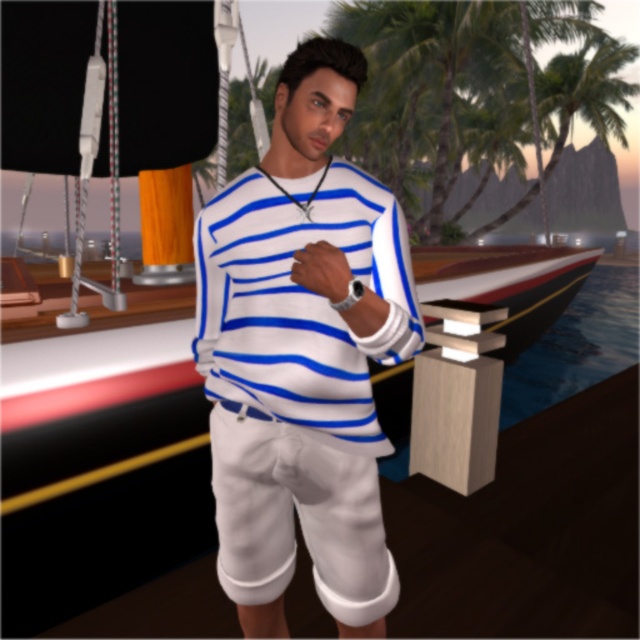
Question: Can you confirm if white matte sweater at center is positioned to the left of green leafy palm tree at upper center?

Choices:
 (A) yes
 (B) no

Answer: (A)

Question: Observing the image, what is the correct spatial positioning of white striped sweater at center in reference to green leafy palm tree at upper center?

Choices:
 (A) above
 (B) below

Answer: (B)

Question: Which object appears closest to the camera in this image?

Choices:
 (A) white cotton shorts at center
 (B) white matte sweater at center
 (C) white striped sweater at center

Answer: (B)

Question: Which object is farther from the camera taking this photo?

Choices:
 (A) green leafy palm tree at upper center
 (B) white striped sweater at center

Answer: (A)

Question: Based on their relative distances, which object is nearer to the green leafy palm tree at upper center?

Choices:
 (A) white cotton shorts at center
 (B) white striped sweater at center

Answer: (B)

Question: Can you confirm if white striped sweater at center is positioned to the left of green leafy palm tree at upper center?

Choices:
 (A) yes
 (B) no

Answer: (A)